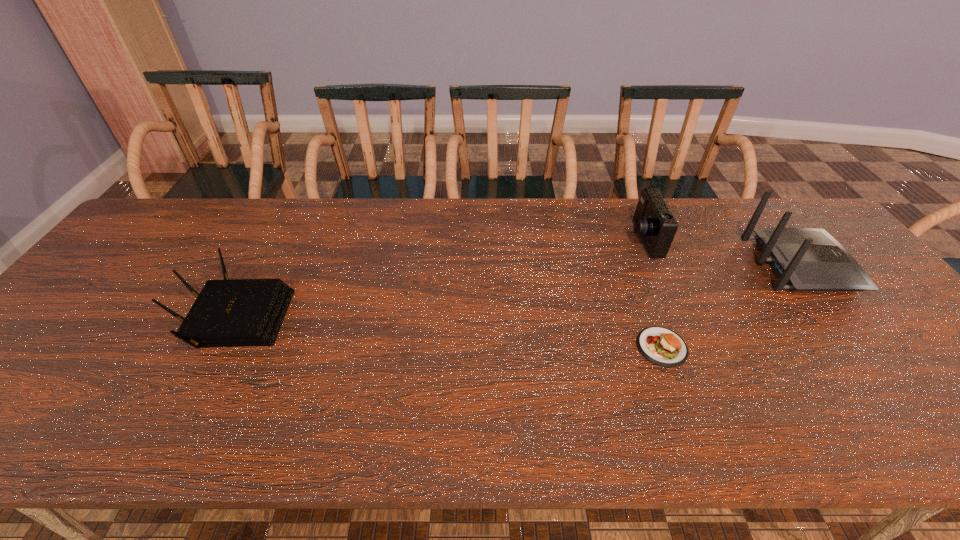
Identify the location of the rightmost object. The image size is (960, 540). (807, 259).

This screenshot has height=540, width=960. In order to click on the taller router in this screenshot , I will do `click(807, 259)`.

Identify the location of camera. Image resolution: width=960 pixels, height=540 pixels. (654, 222).

Identify the location of the leftmost object. This screenshot has width=960, height=540. (241, 312).

Find the location of a particular element. This screenshot has height=540, width=960. the left router is located at coordinates (241, 312).

You are a GUI agent. You are given a task and a screenshot of the screen. Output one action in this format:
    pyautogui.click(x=<x>, y=<y>)
    Task: Click on the shortest object
    This screenshot has width=960, height=540.
    Given the screenshot: What is the action you would take?
    pyautogui.click(x=661, y=346)

Where is `vacant space located on the front-facing side of the camera`? vacant space located on the front-facing side of the camera is located at coordinates (564, 240).

The image size is (960, 540). I want to click on vacant region located 0.080m on the front-facing side of the camera, so coord(603,240).

Identify the location of free space located 0.340m on the front-facing side of the camera. The height and width of the screenshot is (540, 960). (516, 240).

Identify the location of blank space located 0.350m on the back of the shorter router. (294, 205).